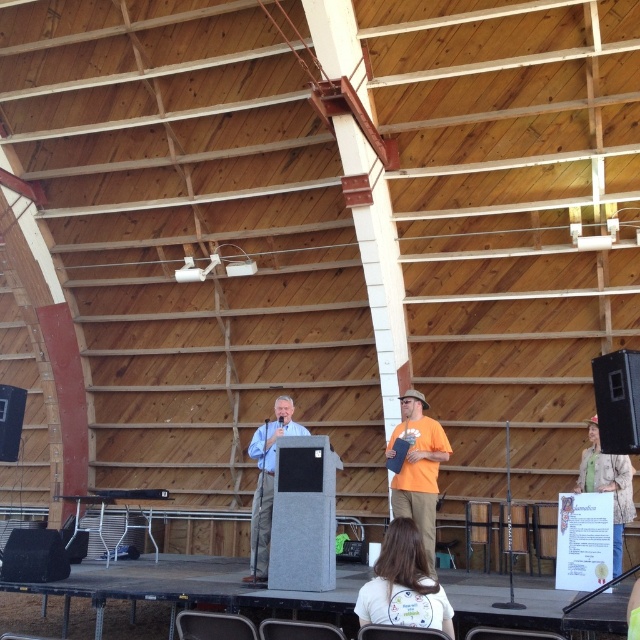
Is matte blue shirt at center above green textured sweater at lower right?

Yes, matte blue shirt at center is above green textured sweater at lower right.

Who is positioned more to the left, matte blue shirt at center or green textured sweater at lower right?

Positioned to the left is matte blue shirt at center.

Locate an element on the screen. The image size is (640, 640). matte blue shirt at center is located at coordinates (266, 483).

Does orange cotton shirt at center come in front of green textured sweater at lower right?

Yes, it is in front of green textured sweater at lower right.

At what (x,y) coordinates should I click in order to perform the action: click on orange cotton shirt at center. Please return your answer as a coordinate pair (x, y). The width and height of the screenshot is (640, 640). Looking at the image, I should click on (419, 468).

At what (x,y) coordinates should I click in order to perform the action: click on orange cotton shirt at center. Please return your answer as a coordinate pair (x, y). Image resolution: width=640 pixels, height=640 pixels. Looking at the image, I should click on (419, 468).

Does matte black speaker at center lie in front of green textured sweater at lower right?

Yes, matte black speaker at center is in front of green textured sweater at lower right.

Between matte black speaker at center and green textured sweater at lower right, which one is positioned lower?

Positioned lower is green textured sweater at lower right.

Describe the element at coordinates (618, 401) in the screenshot. The width and height of the screenshot is (640, 640). I see `matte black speaker at center` at that location.

At what (x,y) coordinates should I click in order to perform the action: click on matte black speaker at center. Please return your answer as a coordinate pair (x, y). Looking at the image, I should click on (618, 401).